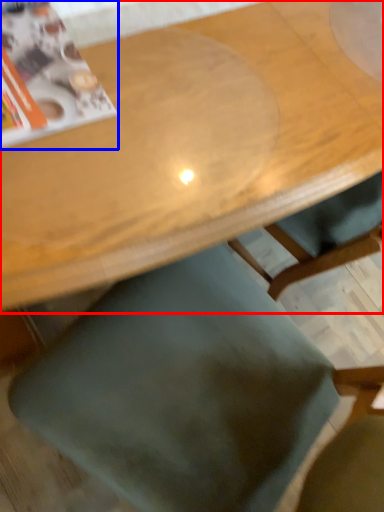
Question: Which point is further to the camera, table (highlighted by a red box) or magazine (highlighted by a blue box)?

Choices:
 (A) table
 (B) magazine

Answer: (B)